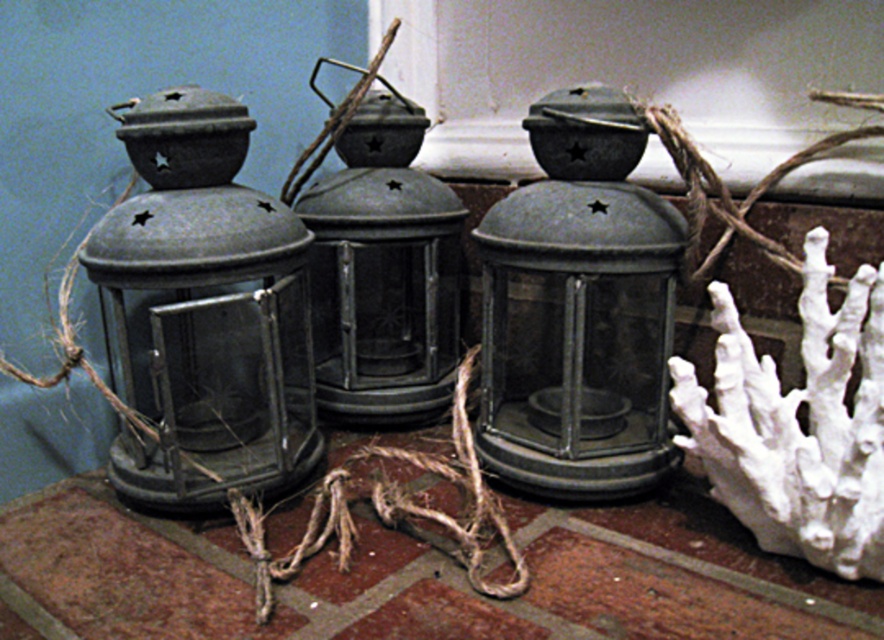
Question: Does matte metal lantern at center have a larger size compared to rustic twine at center?

Choices:
 (A) yes
 (B) no

Answer: (B)

Question: Which point is farther to the camera?

Choices:
 (A) matte black lantern at center
 (B) matte black lantern at left
 (C) rustic twine at center

Answer: (A)

Question: Can you confirm if matte metal lantern at center is bigger than rustic twine at center?

Choices:
 (A) yes
 (B) no

Answer: (B)

Question: Which object appears farthest from the camera in this image?

Choices:
 (A) matte metal lantern at center
 (B) matte black lantern at center

Answer: (A)

Question: Where is matte black lantern at center located in relation to matte metal lantern at center in the image?

Choices:
 (A) above
 (B) below

Answer: (B)

Question: Which object is closer to the camera taking this photo?

Choices:
 (A) matte metal lantern at center
 (B) rustic twine at center
 (C) matte black lantern at center
 (D) matte black lantern at left

Answer: (B)